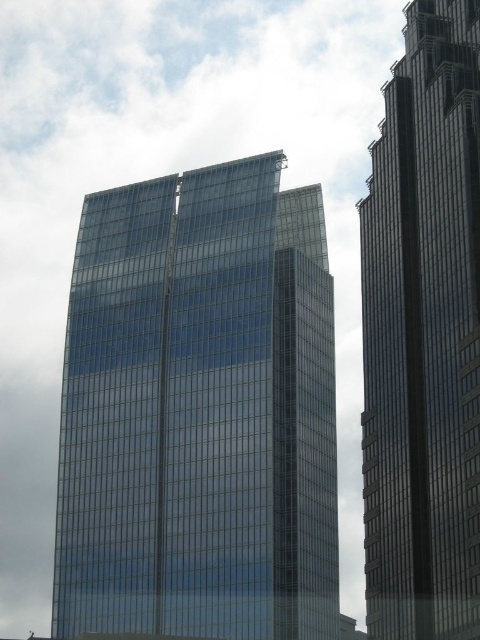
You are standing at the point with coordinates 0.4, 0.4. You want to walk to the transparent glass building at center. In which direction should you move?

You should move towards the northeast direction to reach the transparent glass building at center located at point (200, 412) from your current position at (192, 256).

You are a drone operator planning to fly a drone between the two skyscrapers. The drone has a maximum flight distance of 80 meters. Based on the scene, can the drone safely fly between the transparent glass building at center and the other skyscraper?

The two skyscrapers are 79.88 meters apart. Since the drone has a maximum flight distance of 80 meters, it can safely fly between the transparent glass building at center and the other skyscraper as the distance is within the drone operator limits.

You are an architect planning to install a flagpole on the roof of the transparent glass building at center. The flagpole requires a minimum height of 50 meters from the ground to the top of the flag. Given that the glassy steel skyscraper at right is 200 meters tall, can the flagpole be installed without exceeding the height limit?

The transparent glass building at center is not as tall as the glassy steel skyscraper at right, which is 200 meters tall. If the flagpole requires a minimum height of 50 meters from the ground to the top of the flag, the transparent glass building at center must be at least 50 meters shorter than 200 meters to accommodate the flagpole. However, since the transparent glass building at center is shorter but the exact height difference isn not provided, we cannot definitively determine if it meets the 50m req